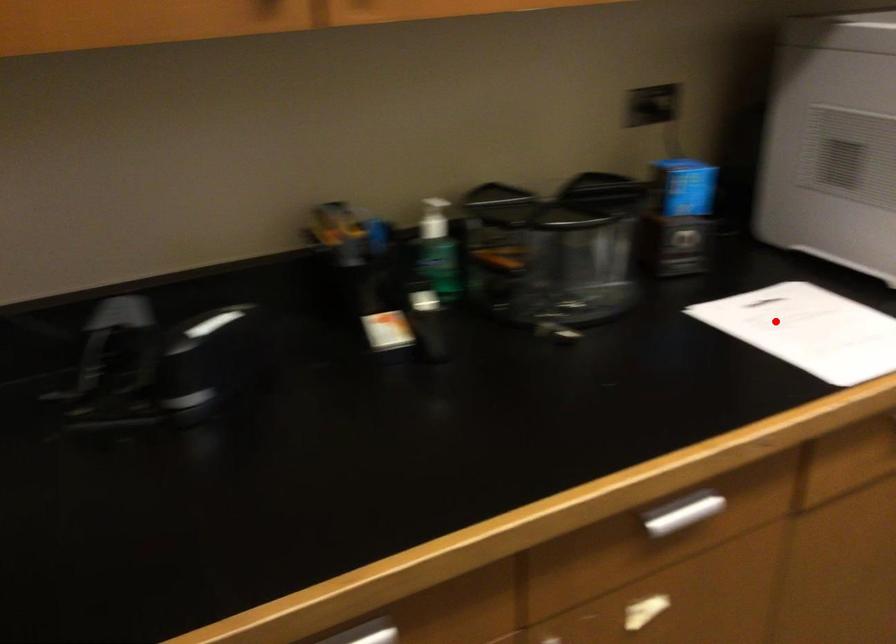
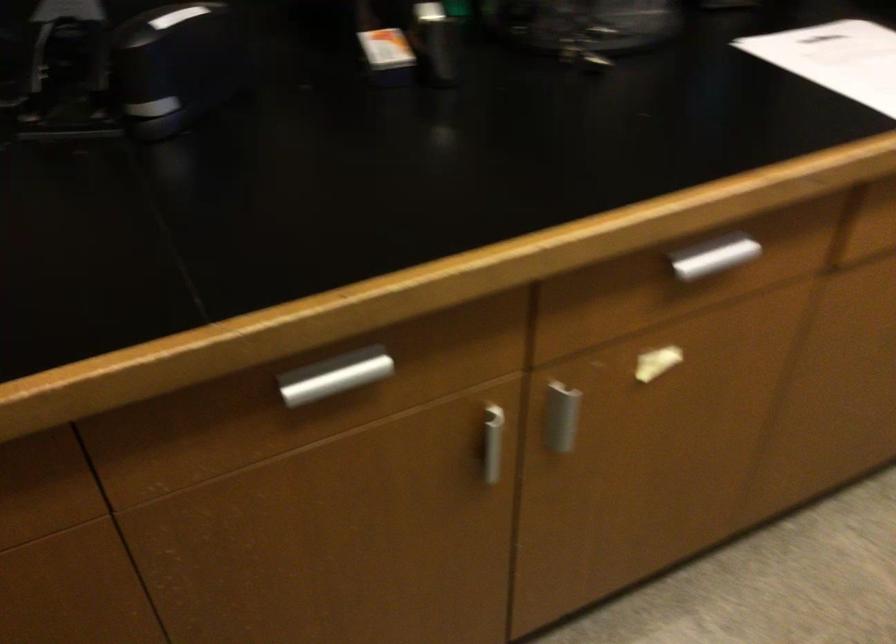
Locate, in the second image, the point that corresponds to the highlighted location in the first image.

(836, 59)